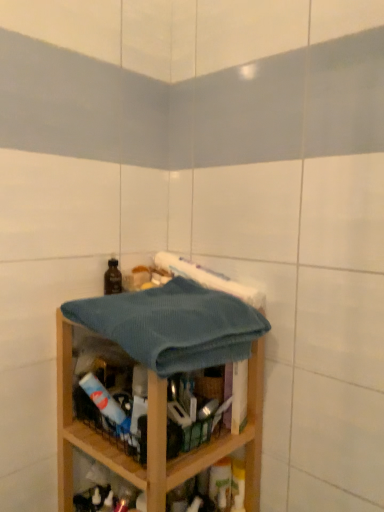
Question: Considering the relative sizes of wooden shelf at center and brown matte bottle at upper left in the image provided, is wooden shelf at center wider than brown matte bottle at upper left?

Choices:
 (A) yes
 (B) no

Answer: (A)

Question: Can you confirm if wooden shelf at center is bigger than brown matte bottle at upper left?

Choices:
 (A) no
 (B) yes

Answer: (B)

Question: Considering the relative positions of wooden shelf at center and brown matte bottle at upper left in the image provided, is wooden shelf at center to the right of brown matte bottle at upper left from the viewer's perspective?

Choices:
 (A) yes
 (B) no

Answer: (A)

Question: Is brown matte bottle at upper left located within wooden shelf at center?

Choices:
 (A) no
 (B) yes

Answer: (A)

Question: From the image's perspective, is wooden shelf at center below brown matte bottle at upper left?

Choices:
 (A) no
 (B) yes

Answer: (B)

Question: Considering the positions of teal waffle towel at center and brown matte bottle at upper left in the image, is teal waffle towel at center taller or shorter than brown matte bottle at upper left?

Choices:
 (A) tall
 (B) short

Answer: (A)

Question: Considering the positions of point (218, 332) and point (112, 276), is point (218, 332) closer or farther from the camera than point (112, 276)?

Choices:
 (A) farther
 (B) closer

Answer: (B)

Question: Is teal waffle towel at center situated inside brown matte bottle at upper left or outside?

Choices:
 (A) inside
 (B) outside

Answer: (B)

Question: From a real-world perspective, is teal waffle towel at center above or below brown matte bottle at upper left?

Choices:
 (A) above
 (B) below

Answer: (B)

Question: From a real-world perspective, is brown matte bottle at upper left above or below wooden shelf at center?

Choices:
 (A) above
 (B) below

Answer: (A)

Question: Visually, is brown matte bottle at upper left positioned to the left or to the right of wooden shelf at center?

Choices:
 (A) right
 (B) left

Answer: (B)

Question: Is point (112, 272) closer or farther from the camera than point (230, 439)?

Choices:
 (A) closer
 (B) farther

Answer: (B)

Question: From their relative heights in the image, would you say brown matte bottle at upper left is taller or shorter than wooden shelf at center?

Choices:
 (A) tall
 (B) short

Answer: (B)

Question: Is wooden shelf at center wider or thinner than teal waffle towel at center?

Choices:
 (A) thin
 (B) wide

Answer: (A)

Question: Would you say wooden shelf at center is to the left or to the right of teal waffle towel at center in the picture?

Choices:
 (A) right
 (B) left

Answer: (B)